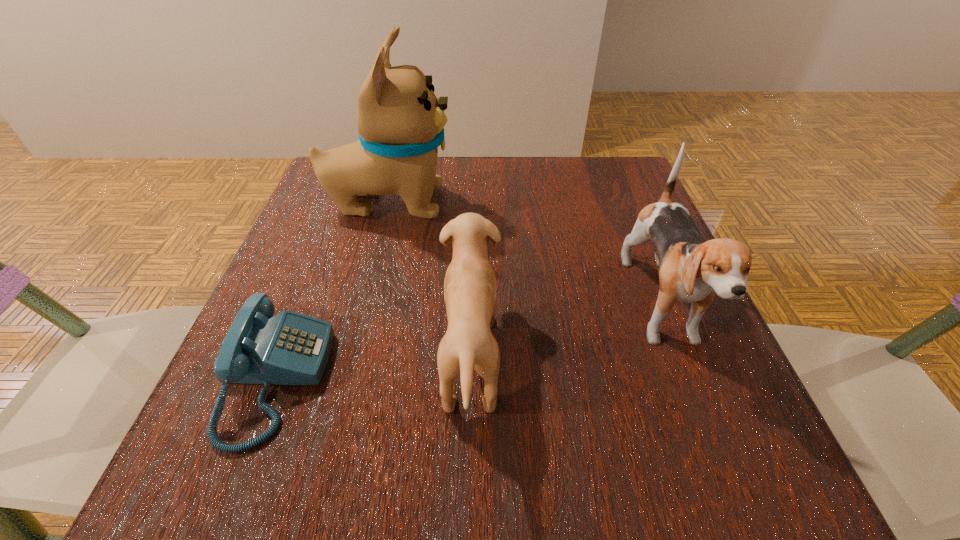
Where is `free space between the shortest object and the third tallest object`? The width and height of the screenshot is (960, 540). free space between the shortest object and the third tallest object is located at coordinates (x=372, y=369).

This screenshot has height=540, width=960. Identify the location of empty space between the third tallest object and the farthest object. (429, 280).

Identify which object is the nearest to the second tallest puppy. Please provide its 2D coordinates. Your answer should be formatted as a tuple, i.e. [(x, y)], where the tuple contains the x and y coordinates of a point satisfying the conditions above.

[(470, 292)]

The image size is (960, 540). I want to click on the closest object to the second tallest object, so click(x=470, y=292).

You are a GUI agent. You are given a task and a screenshot of the screen. Output one action in this format:
    pyautogui.click(x=<x>, y=<y>)
    Task: Click on the closest puppy to the farthest object
    The height and width of the screenshot is (540, 960).
    Given the screenshot: What is the action you would take?
    pyautogui.click(x=470, y=292)

The width and height of the screenshot is (960, 540). What are the coordinates of `puppy that is the second closest one to the second shortest object` in the screenshot? It's located at (692, 270).

This screenshot has width=960, height=540. Find the location of `free space that satisfies the following two spatial constraints: 1. at the face of the second shortest puppy; 2. on the left side of the shortest puppy`. free space that satisfies the following two spatial constraints: 1. at the face of the second shortest puppy; 2. on the left side of the shortest puppy is located at coordinates (681, 357).

You are a GUI agent. You are given a task and a screenshot of the screen. Output one action in this format:
    pyautogui.click(x=<x>, y=<y>)
    Task: Click on the blank space that satisfies the following two spatial constraints: 1. at the face of the second tallest puppy; 2. on the dial of the shortest object
    
    Given the screenshot: What is the action you would take?
    pyautogui.click(x=689, y=380)

Where is `vacant space that satisfies the following two spatial constraints: 1. at the face of the rightmost puppy; 2. on the dial of the telephone`? Image resolution: width=960 pixels, height=540 pixels. vacant space that satisfies the following two spatial constraints: 1. at the face of the rightmost puppy; 2. on the dial of the telephone is located at coordinates (689, 380).

Locate an element on the screen. free space that satisfies the following two spatial constraints: 1. at the face of the second tallest puppy; 2. on the left side of the second shortest object is located at coordinates 681,357.